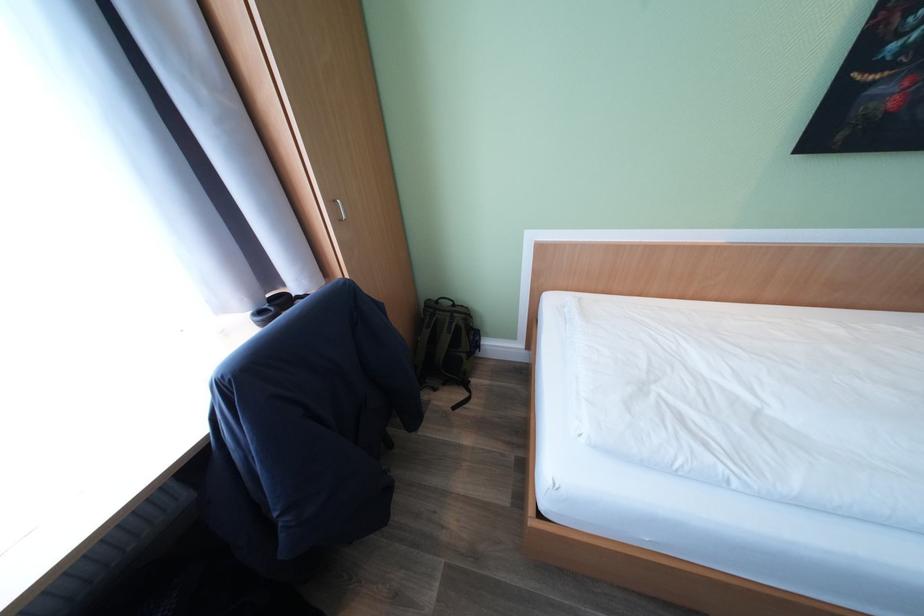
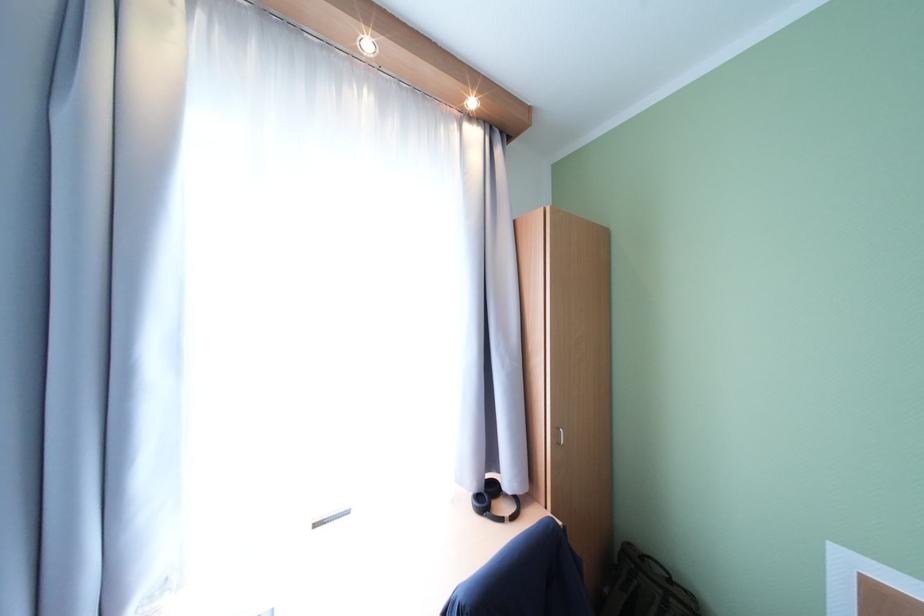
The point at (266, 314) is marked in the first image. Where is the corresponding point in the second image?

(484, 498)